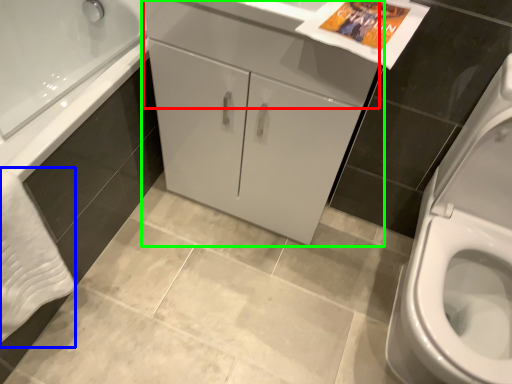
Question: Which object is positioned closest to drawer (highlighted by a red box)? Select from bath towel (highlighted by a blue box) and bathroom cabinet (highlighted by a green box).

Choices:
 (A) bath towel
 (B) bathroom cabinet

Answer: (B)